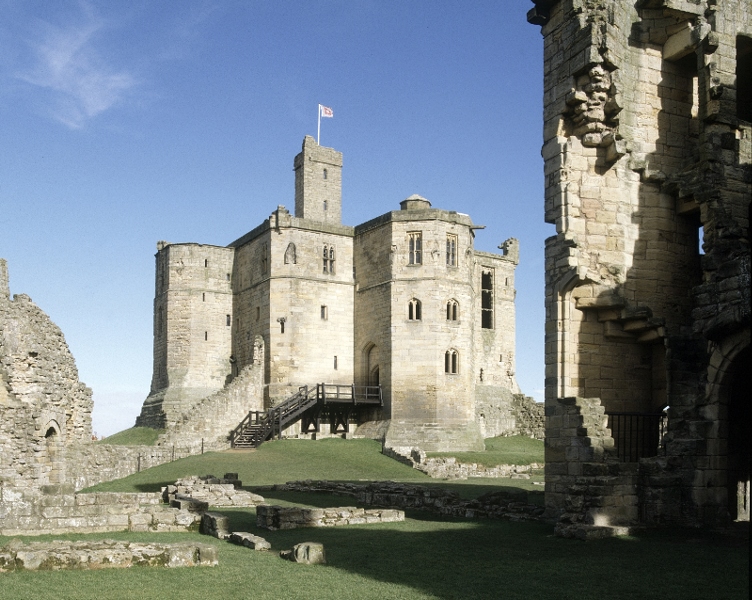
You are a GUI agent. You are given a task and a screenshot of the screen. Output one action in this format:
    pyautogui.click(x=<x>, y=<y>)
    Task: Click on the arched doorway
    
    Given the screenshot: What is the action you would take?
    pyautogui.click(x=52, y=442), pyautogui.click(x=371, y=375)